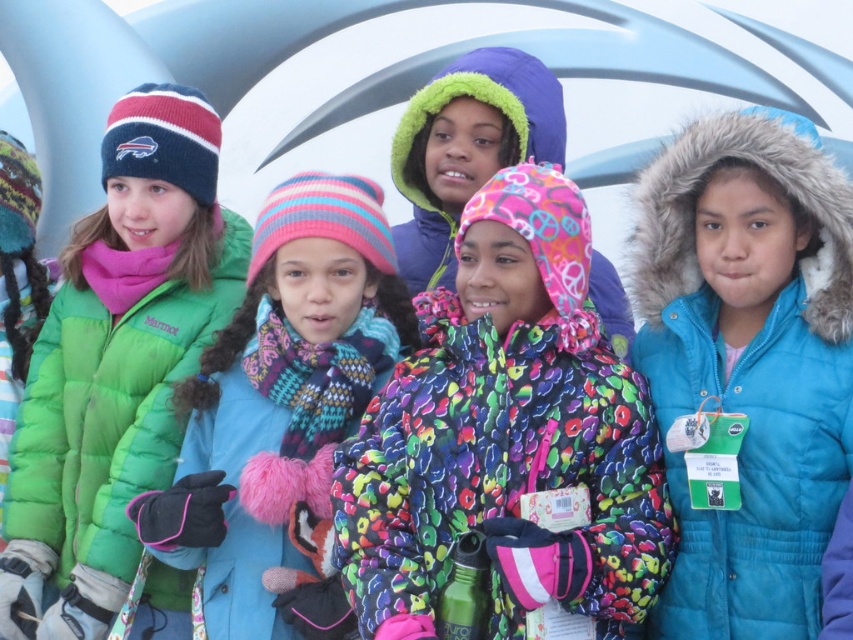
Looking at this image, you are a photographer trying to capture a photo of the blue fuzzy coat at right and the green puffy coat at left. Based on their positions, which coat should you focus on first if you want to include both in the frame without moving the camera?

The blue fuzzy coat at right is above the green puffy coat at left, so you should focus on the blue fuzzy coat at right first to ensure both are in the frame.

You are a photographer trying to capture a group photo of the children. You notice the blue fuzzy coat at right and the green puffy coat at left. Which child should you ask to move closer to the center to ensure both coats are equally visible in the photo?

Since the blue fuzzy coat at right has a lesser width compared to the green puffy coat at left, you should ask the child in the blue fuzzy coat at right to move closer to the center so that both coats can be equally visible in the photo.

You are a photographer trying to capture the children in the scene. You want to ensure that both the pink knitted hat at center and the green puffy coat at left are clearly visible in your photo. Based on their positions, which object should you focus on first to ensure both are in frame?

The pink knitted hat at center is located below the green puffy coat at left. To ensure both are in frame, focus on the green puffy coat at left first since it is higher up, allowing the camera to capture the lower positioned pink knitted hat at center naturally within the same shot.